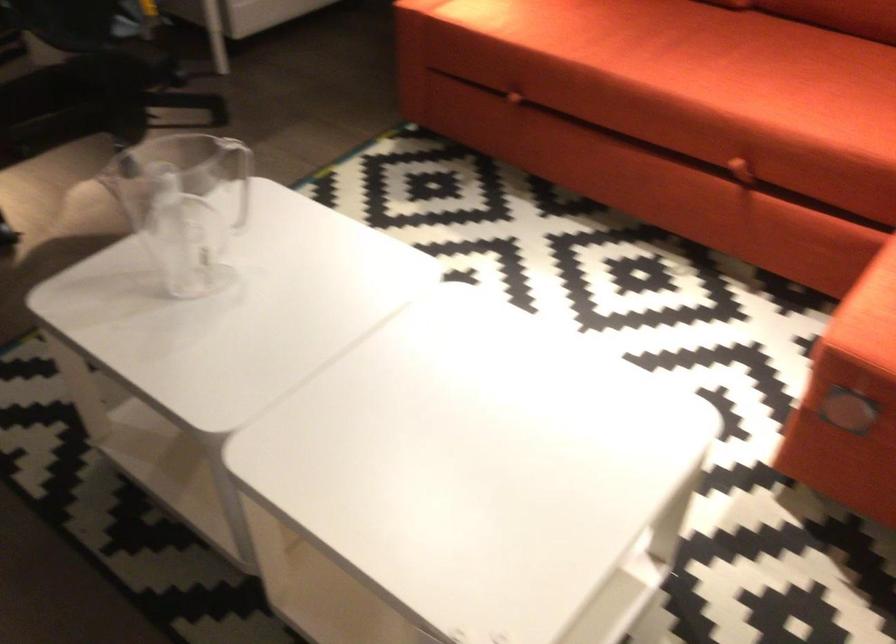
Image resolution: width=896 pixels, height=644 pixels. What do you see at coordinates (688, 80) in the screenshot?
I see `the sofa sitting surface` at bounding box center [688, 80].